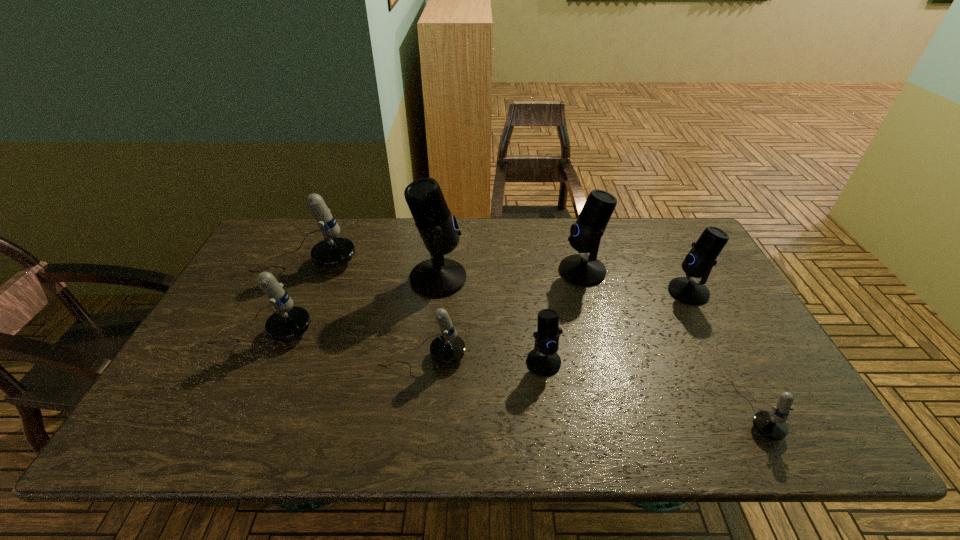
Locate an element on the screen. free space at the right edge of the desktop is located at coordinates (710, 272).

At what (x,y) coordinates should I click in order to perform the action: click on free space that is in between the nearest object and the third smallest white microphone. Please return your answer as a coordinate pair (x, y). This screenshot has height=540, width=960. Looking at the image, I should click on (509, 372).

At what (x,y) coordinates should I click in order to perform the action: click on blank region between the third biggest black microphone and the second biggest black microphone. Please return your answer as a coordinate pair (x, y). The height and width of the screenshot is (540, 960). Looking at the image, I should click on (636, 281).

Where is `empty space between the nearest white microphone and the tallest microphone`? The image size is (960, 540). empty space between the nearest white microphone and the tallest microphone is located at coordinates (597, 345).

The width and height of the screenshot is (960, 540). Find the location of `free area in between the farthest white microphone and the rightmost black microphone`. free area in between the farthest white microphone and the rightmost black microphone is located at coordinates (497, 277).

This screenshot has height=540, width=960. I want to click on vacant space that is in between the nearest white microphone and the third biggest white microphone, so click(x=589, y=383).

This screenshot has height=540, width=960. Identify the location of vacant space that's between the biggest black microphone and the third object from right to left. (511, 274).

At what (x,y) coordinates should I click in order to perform the action: click on free space between the tallest object and the third smallest black microphone. Please return your answer as a coordinate pair (x, y). The image size is (960, 540). Looking at the image, I should click on (511, 274).

Locate an element on the screen. Image resolution: width=960 pixels, height=540 pixels. vacant region between the third black microphone from right to left and the second biggest white microphone is located at coordinates (402, 347).

You are a GUI agent. You are given a task and a screenshot of the screen. Output one action in this format:
    pyautogui.click(x=<x>, y=<y>)
    Task: Click on the free area in between the second biggest white microphone and the third biggest white microphone
    This screenshot has width=960, height=540.
    Given the screenshot: What is the action you would take?
    pyautogui.click(x=342, y=344)